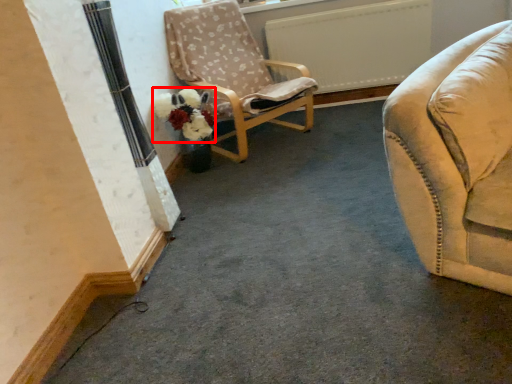
Question: From the image's perspective, what is the correct spatial relationship of flower (annotated by the red box) in relation to chair?

Choices:
 (A) above
 (B) below

Answer: (B)